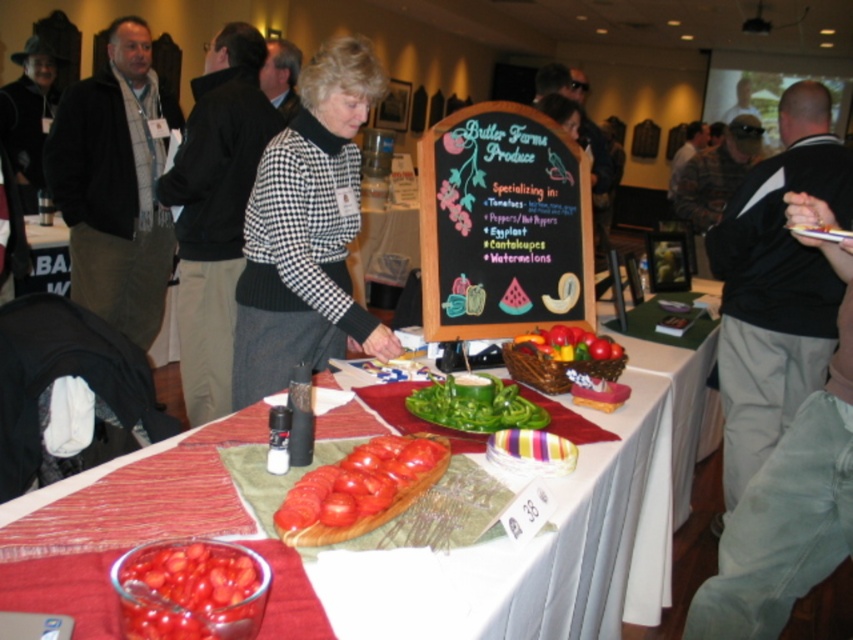
Question: Is black sweater at upper right bigger than glossy glass bowl at lower left?

Choices:
 (A) no
 (B) yes

Answer: (B)

Question: Which of the following is the farthest from the observer?

Choices:
 (A) (569, 188)
 (B) (183, 481)
 (C) (664, 296)

Answer: (C)

Question: In this image, where is black checkered sweater at center located relative to white fabric table at center?

Choices:
 (A) right
 (B) left

Answer: (B)

Question: Can you confirm if black checkered sweater at center is wider than black houndstooth sweater at upper center?

Choices:
 (A) no
 (B) yes

Answer: (B)

Question: Which of the following is the closest to the observer?

Choices:
 (A) glossy glass bowl at lower left
 (B) green smoothmaterial/texture at center
 (C) black sweater at upper right
 (D) black houndstooth sweater at upper center

Answer: (A)

Question: Which is farther from the glossy glass bowl at lower left?

Choices:
 (A) green smoothmaterial/texture at center
 (B) black houndstooth sweater at upper center
 (C) black sweater at upper right
 (D) black checkered sweater at center

Answer: (C)